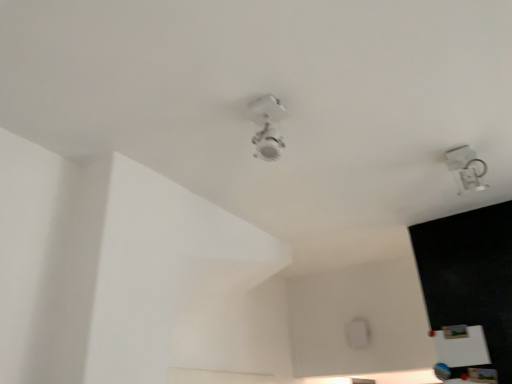
Question: Should I look upward or downward to see transparent plastic lamp at upper right, positioned as the 2th lamp in left-to-right order?

Choices:
 (A) down
 (B) up

Answer: (B)

Question: Is transparent plastic lamp at upper right, arranged as the first lamp when viewed from the right, thinner than white glossy ceiling light at center, the first lamp positioned from the left?

Choices:
 (A) no
 (B) yes

Answer: (A)

Question: Does transparent plastic lamp at upper right, positioned as the 2th lamp in left-to-right order, come behind white glossy ceiling light at center, the 2th lamp positioned from the right?

Choices:
 (A) yes
 (B) no

Answer: (A)

Question: Does transparent plastic lamp at upper right, arranged as the first lamp when viewed from the right, touch white glossy ceiling light at center, the first lamp positioned from the left?

Choices:
 (A) no
 (B) yes

Answer: (A)

Question: Is transparent plastic lamp at upper right, the first lamp positioned from the back, taller than white glossy ceiling light at center, the 2th lamp positioned from the right?

Choices:
 (A) yes
 (B) no

Answer: (A)

Question: Is transparent plastic lamp at upper right, arranged as the first lamp when viewed from the right, turned away from white glossy ceiling light at center, the first lamp positioned from the left?

Choices:
 (A) yes
 (B) no

Answer: (B)

Question: Does transparent plastic lamp at upper right, positioned as the 2th lamp in left-to-right order, come in front of white glossy ceiling light at center, the first lamp when ordered from front to back?

Choices:
 (A) yes
 (B) no

Answer: (B)

Question: Considering the relative sizes of white glossy ceiling light at center, marked as the second lamp in a back-to-front arrangement, and transparent plastic lamp at upper right, arranged as the first lamp when viewed from the right, in the image provided, is white glossy ceiling light at center, marked as the second lamp in a back-to-front arrangement, bigger than transparent plastic lamp at upper right, arranged as the first lamp when viewed from the right,?

Choices:
 (A) no
 (B) yes

Answer: (A)

Question: Is white glossy ceiling light at center, marked as the second lamp in a back-to-front arrangement, touching transparent plastic lamp at upper right, arranged as the first lamp when viewed from the right?

Choices:
 (A) yes
 (B) no

Answer: (B)

Question: Considering the relative sizes of white glossy ceiling light at center, the first lamp positioned from the left, and transparent plastic lamp at upper right, arranged as the first lamp when viewed from the right, in the image provided, is white glossy ceiling light at center, the first lamp positioned from the left, smaller than transparent plastic lamp at upper right, arranged as the first lamp when viewed from the right,?

Choices:
 (A) yes
 (B) no

Answer: (A)

Question: Would you consider white glossy ceiling light at center, marked as the second lamp in a back-to-front arrangement, to be distant from transparent plastic lamp at upper right, positioned as the 2th lamp in left-to-right order?

Choices:
 (A) no
 (B) yes

Answer: (A)

Question: Is white glossy ceiling light at center, the first lamp positioned from the left, facing towards transparent plastic lamp at upper right, positioned as the 2th lamp in left-to-right order?

Choices:
 (A) no
 (B) yes

Answer: (A)

Question: From a real-world perspective, is white glossy ceiling light at center, marked as the second lamp in a back-to-front arrangement, positioned under transparent plastic lamp at upper right, the first lamp positioned from the back, based on gravity?

Choices:
 (A) no
 (B) yes

Answer: (A)

Question: From the image's perspective, relative to white glossy ceiling light at center, the 2th lamp positioned from the right, is transparent plastic lamp at upper right, arranged as the first lamp when viewed from the right, above or below?

Choices:
 (A) above
 (B) below

Answer: (B)